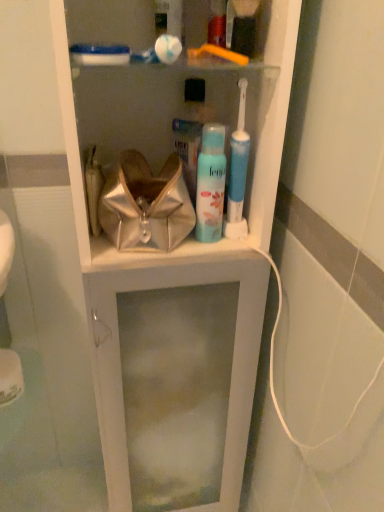
Locate an element on the screen. The image size is (384, 512). blue matte spray can at center is located at coordinates (210, 184).

What do you see at coordinates (210, 184) in the screenshot? The height and width of the screenshot is (512, 384). I see `blue matte spray can at center` at bounding box center [210, 184].

You are a GUI agent. You are given a task and a screenshot of the screen. Output one action in this format:
    pyautogui.click(x=<x>, y=<y>)
    Task: Click on the metallic shiny handbag at center
    The width and height of the screenshot is (384, 512).
    Given the screenshot: What is the action you would take?
    pyautogui.click(x=146, y=205)

The width and height of the screenshot is (384, 512). Describe the element at coordinates (146, 205) in the screenshot. I see `metallic shiny handbag at center` at that location.

Find the location of a particular element. This screenshot has height=512, width=384. blue matte spray can at center is located at coordinates (210, 184).

Considering the positions of objects blue matte spray can at center and metallic shiny handbag at center in the image provided, who is more to the left, blue matte spray can at center or metallic shiny handbag at center?

metallic shiny handbag at center is more to the left.

Who is more distant, blue matte spray can at center or metallic shiny handbag at center?

blue matte spray can at center.

Is point (207, 134) closer or farther from the camera than point (171, 200)?

Point (207, 134).

From the image's perspective, between blue matte spray can at center and metallic shiny handbag at center, who is located below?

blue matte spray can at center.

From a real-world perspective, is blue matte spray can at center above or below metallic shiny handbag at center?

From a real-world perspective, blue matte spray can at center is physically above metallic shiny handbag at center.

Can you confirm if blue matte spray can at center is thinner than metallic shiny handbag at center?

Correct, the width of blue matte spray can at center is less than that of metallic shiny handbag at center.

Can you confirm if blue matte spray can at center is shorter than metallic shiny handbag at center?

Incorrect, the height of blue matte spray can at center does not fall short of that of metallic shiny handbag at center.

Considering the sizes of objects blue matte spray can at center and metallic shiny handbag at center in the image provided, who is smaller, blue matte spray can at center or metallic shiny handbag at center?

Smaller between the two is blue matte spray can at center.

Is blue matte spray can at center located outside metallic shiny handbag at center?

Absolutely, blue matte spray can at center is external to metallic shiny handbag at center.

Is blue matte spray can at center far from metallic shiny handbag at center?

They are positioned close to each other.

Is blue matte spray can at center facing away from metallic shiny handbag at center?

No, blue matte spray can at center is not facing the opposite direction of metallic shiny handbag at center.

Measure the distance from blue matte spray can at center to metallic shiny handbag at center.

blue matte spray can at center is 9.21 centimeters from metallic shiny handbag at center.

Identify the location of handbag in front of the blue matte spray can at center. (146, 205).

Considering the positions of objects metallic shiny handbag at center and blue matte spray can at center in the image provided, who is more to the left, metallic shiny handbag at center or blue matte spray can at center?

From the viewer's perspective, metallic shiny handbag at center appears more on the left side.

Is the position of metallic shiny handbag at center more distant than that of blue matte spray can at center?

No, the depth of metallic shiny handbag at center is less than that of blue matte spray can at center.

Is point (170, 209) farther from viewer compared to point (206, 184)?

That is False.

From the image's perspective, is metallic shiny handbag at center under blue matte spray can at center?

No, from the image's perspective, metallic shiny handbag at center is not beneath blue matte spray can at center.

From the picture: From a real-world perspective, is metallic shiny handbag at center above or below blue matte spray can at center?

Clearly, from a real-world perspective, metallic shiny handbag at center is below blue matte spray can at center.

Considering the relative sizes of metallic shiny handbag at center and blue matte spray can at center in the image provided, is metallic shiny handbag at center wider than blue matte spray can at center?

Indeed, metallic shiny handbag at center has a greater width compared to blue matte spray can at center.

Considering the sizes of objects metallic shiny handbag at center and blue matte spray can at center in the image provided, who is shorter, metallic shiny handbag at center or blue matte spray can at center?

With less height is metallic shiny handbag at center.

Which of these two, metallic shiny handbag at center or blue matte spray can at center, is smaller?

With smaller size is blue matte spray can at center.

Would you say metallic shiny handbag at center is inside or outside blue matte spray can at center?

metallic shiny handbag at center is spatially situated outside blue matte spray can at center.

Are metallic shiny handbag at center and blue matte spray can at center making contact?

Yes, metallic shiny handbag at center is beside blue matte spray can at center.

Is metallic shiny handbag at center facing towards blue matte spray can at center?

No, metallic shiny handbag at center is not aimed at blue matte spray can at center.

How different are the orientations of metallic shiny handbag at center and blue matte spray can at center in degrees?

The angle between the facing direction of metallic shiny handbag at center and the facing direction of blue matte spray can at center is 0.000132 degrees.

Measure the distance between metallic shiny handbag at center and blue matte spray can at center.

They are 3.62 inches apart.

Where is `toiletry that appears below the metallic shiny handbag at center (from the image's perspective)`? The image size is (384, 512). toiletry that appears below the metallic shiny handbag at center (from the image's perspective) is located at coordinates (210, 184).

Find the location of a particular element. toiletry lying behind the metallic shiny handbag at center is located at coordinates (210, 184).

Identify the location of handbag that is above the blue matte spray can at center (from the image's perspective). (146, 205).